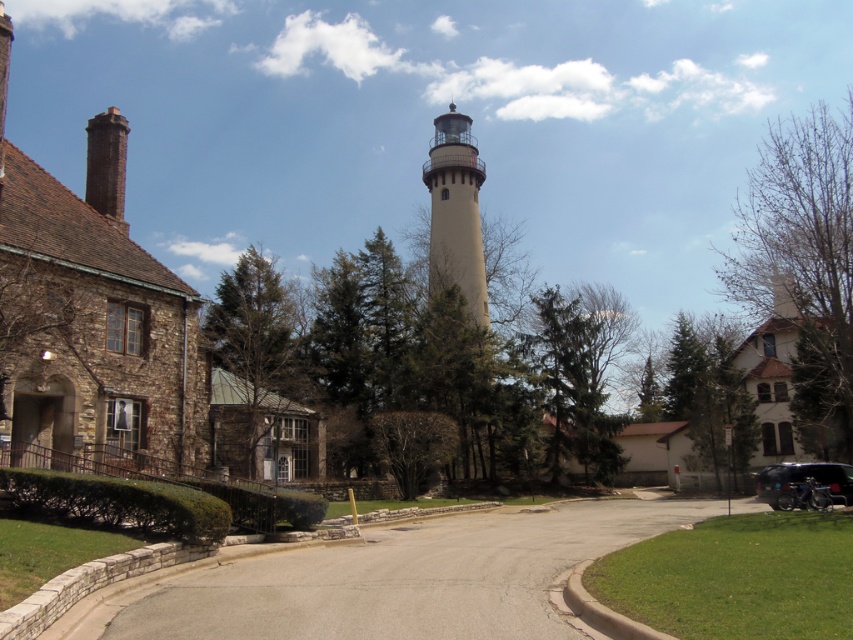
Question: Is gray asphalt driveway at center closer to camera compared to beige stucco tower at center?

Choices:
 (A) no
 (B) yes

Answer: (B)

Question: Can you confirm if gray asphalt driveway at center is thinner than beige stucco tower at center?

Choices:
 (A) no
 (B) yes

Answer: (A)

Question: Which object appears farthest from the camera in this image?

Choices:
 (A) beige stucco tower at center
 (B) gray asphalt driveway at center

Answer: (A)

Question: Which point is farther to the camera?

Choices:
 (A) gray asphalt driveway at center
 (B) beige stucco tower at center

Answer: (B)

Question: Does gray asphalt driveway at center appear on the left side of beige stucco tower at center?

Choices:
 (A) yes
 (B) no

Answer: (B)